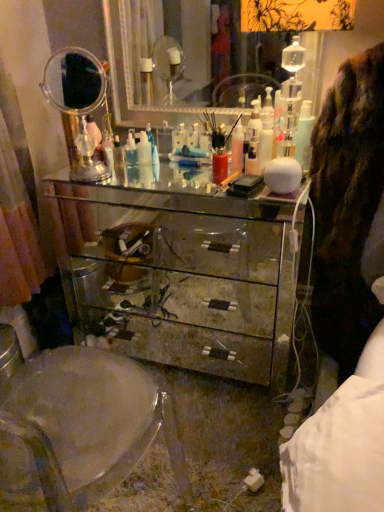
Question: Does transparent plastic swivel chair at center come in front of silver mirrored dresser at upper center, the 1th mirror viewed from the right?

Choices:
 (A) yes
 (B) no

Answer: (A)

Question: Considering the relative sizes of transparent plastic swivel chair at center and silver mirrored dresser at upper center, the 1th mirror viewed from the right, in the image provided, is transparent plastic swivel chair at center smaller than silver mirrored dresser at upper center, the 1th mirror viewed from the right,?

Choices:
 (A) no
 (B) yes

Answer: (A)

Question: Is transparent plastic swivel chair at center further to camera compared to silver mirrored dresser at upper center, which is the second mirror from left to right?

Choices:
 (A) yes
 (B) no

Answer: (B)

Question: Can you confirm if transparent plastic swivel chair at center is taller than silver mirrored dresser at upper center, the 1th mirror viewed from the right?

Choices:
 (A) no
 (B) yes

Answer: (B)

Question: Is transparent plastic swivel chair at center in contact with silver mirrored dresser at upper center, which is the second mirror from left to right?

Choices:
 (A) yes
 (B) no

Answer: (B)

Question: Can silver mirrored dresser at upper center, the 1th mirror viewed from the right, be found inside transparent plastic swivel chair at center?

Choices:
 (A) no
 (B) yes

Answer: (A)

Question: Considering the relative sizes of transparent plastic swivel chair at center and clear glass mirror at upper left, positioned as the first mirror in left-to-right order, in the image provided, is transparent plastic swivel chair at center shorter than clear glass mirror at upper left, positioned as the first mirror in left-to-right order,?

Choices:
 (A) no
 (B) yes

Answer: (A)

Question: From the image's perspective, is transparent plastic swivel chair at center beneath clear glass mirror at upper left, positioned as the first mirror in left-to-right order?

Choices:
 (A) no
 (B) yes

Answer: (B)

Question: Does transparent plastic swivel chair at center appear on the left side of clear glass mirror at upper left, positioned as the first mirror in left-to-right order?

Choices:
 (A) yes
 (B) no

Answer: (B)

Question: Can you confirm if transparent plastic swivel chair at center is bigger than clear glass mirror at upper left, the second mirror viewed from the right?

Choices:
 (A) no
 (B) yes

Answer: (B)

Question: Are transparent plastic swivel chair at center and clear glass mirror at upper left, positioned as the first mirror in left-to-right order, far apart?

Choices:
 (A) no
 (B) yes

Answer: (A)

Question: Considering the relative sizes of transparent plastic swivel chair at center and clear glass mirror at upper left, positioned as the first mirror in left-to-right order, in the image provided, is transparent plastic swivel chair at center thinner than clear glass mirror at upper left, positioned as the first mirror in left-to-right order,?

Choices:
 (A) yes
 (B) no

Answer: (B)

Question: Does white glossy bottle at upper right have a greater width compared to silver mirrored dresser at upper center, the 1th mirror viewed from the right?

Choices:
 (A) no
 (B) yes

Answer: (A)